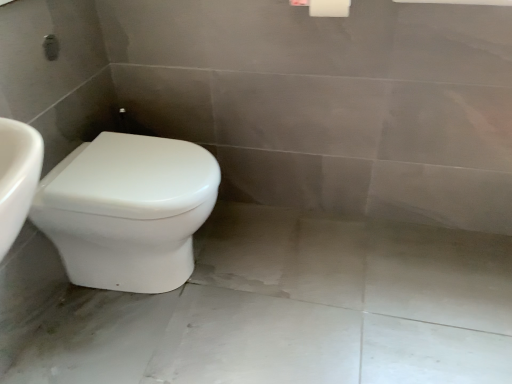
Question: Should I look upward or downward to see white glossy concrete at lower left?

Choices:
 (A) up
 (B) down

Answer: (B)

Question: Considering the relative positions of white glossy toilet at lower left and white glossy concrete at lower left in the image provided, is white glossy toilet at lower left to the right of white glossy concrete at lower left from the viewer's perspective?

Choices:
 (A) no
 (B) yes

Answer: (A)

Question: Is white glossy toilet at lower left shorter than white glossy concrete at lower left?

Choices:
 (A) yes
 (B) no

Answer: (B)

Question: From the image's perspective, is white glossy toilet at lower left under white glossy concrete at lower left?

Choices:
 (A) yes
 (B) no

Answer: (B)

Question: From a real-world perspective, does white glossy toilet at lower left sit lower than white glossy concrete at lower left?

Choices:
 (A) no
 (B) yes

Answer: (A)

Question: Considering the relative sizes of white glossy toilet at lower left and white glossy concrete at lower left in the image provided, is white glossy toilet at lower left smaller than white glossy concrete at lower left?

Choices:
 (A) no
 (B) yes

Answer: (A)

Question: Does white glossy toilet at lower left have a greater height compared to white glossy concrete at lower left?

Choices:
 (A) no
 (B) yes

Answer: (B)

Question: Is white glossy concrete at lower left to the right of white glossy toilet at lower left from the viewer's perspective?

Choices:
 (A) no
 (B) yes

Answer: (B)

Question: From the image's perspective, is white glossy concrete at lower left below white glossy toilet at lower left?

Choices:
 (A) no
 (B) yes

Answer: (B)

Question: Is white glossy concrete at lower left facing towards white glossy toilet at lower left?

Choices:
 (A) yes
 (B) no

Answer: (B)

Question: Does white glossy concrete at lower left have a larger size compared to white glossy toilet at lower left?

Choices:
 (A) no
 (B) yes

Answer: (A)

Question: Can you confirm if white glossy concrete at lower left is taller than white glossy toilet at lower left?

Choices:
 (A) no
 (B) yes

Answer: (A)

Question: Is white glossy concrete at lower left positioned beyond the bounds of white glossy toilet at lower left?

Choices:
 (A) no
 (B) yes

Answer: (B)

Question: From a real-world perspective, is white glossy toilet at lower left above or below white glossy concrete at lower left?

Choices:
 (A) below
 (B) above

Answer: (B)